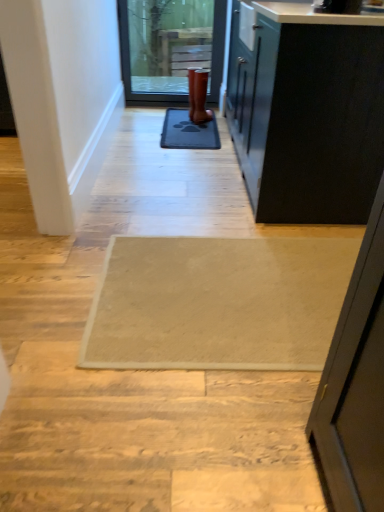
Question: From a real-world perspective, is rubber boot at center below black rubber mat at center?

Choices:
 (A) yes
 (B) no

Answer: (B)

Question: Would you consider rubber boot at center to be distant from black rubber mat at center?

Choices:
 (A) yes
 (B) no

Answer: (B)

Question: Is black rubber mat at center at the back of rubber boot at center?

Choices:
 (A) no
 (B) yes

Answer: (A)

Question: From the image's perspective, would you say rubber boot at center is shown under black rubber mat at center?

Choices:
 (A) no
 (B) yes

Answer: (A)

Question: Can you confirm if rubber boot at center is taller than black rubber mat at center?

Choices:
 (A) yes
 (B) no

Answer: (A)

Question: From the image's perspective, relative to beige textured rug at center, is matte glass door at upper center above or below?

Choices:
 (A) below
 (B) above

Answer: (B)

Question: Is matte glass door at upper center taller or shorter than beige textured rug at center?

Choices:
 (A) tall
 (B) short

Answer: (A)

Question: From a real-world perspective, is matte glass door at upper center physically located above or below beige textured rug at center?

Choices:
 (A) above
 (B) below

Answer: (A)

Question: Do you think matte glass door at upper center is within beige textured rug at center, or outside of it?

Choices:
 (A) inside
 (B) outside

Answer: (B)

Question: In terms of width, does matte glass door at upper center look wider or thinner when compared to rubber boot at center?

Choices:
 (A) wide
 (B) thin

Answer: (B)

Question: Do you think matte glass door at upper center is within rubber boot at center, or outside of it?

Choices:
 (A) outside
 (B) inside

Answer: (A)

Question: Based on their sizes in the image, would you say matte glass door at upper center is bigger or smaller than rubber boot at center?

Choices:
 (A) small
 (B) big

Answer: (B)

Question: Is point (200, 59) positioned closer to the camera than point (198, 94)?

Choices:
 (A) closer
 (B) farther

Answer: (B)

Question: Would you say matte glass door at upper center is inside or outside black rubber mat at center?

Choices:
 (A) inside
 (B) outside

Answer: (B)

Question: Does point (175, 57) appear closer or farther from the camera than point (188, 123)?

Choices:
 (A) farther
 (B) closer

Answer: (A)